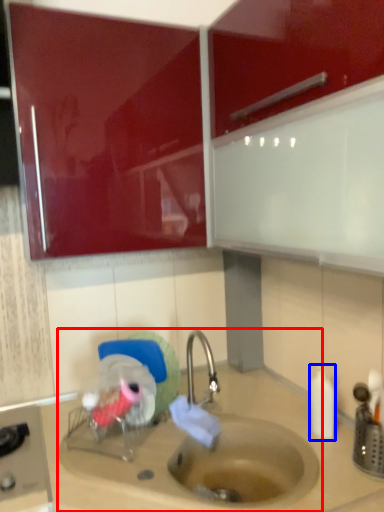
Question: Which of the following is the closest to the observer, sink (highlighted by a red box) or bottle (highlighted by a blue box)?

Choices:
 (A) sink
 (B) bottle

Answer: (A)